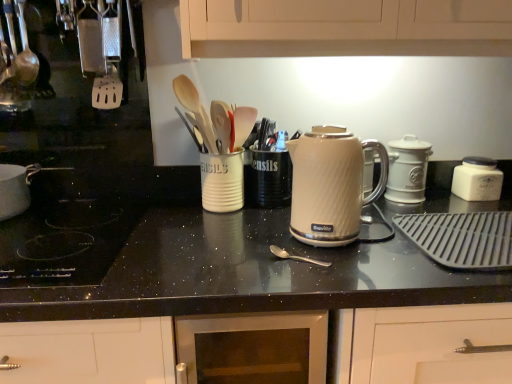
This screenshot has width=512, height=384. Identify the location of free space that is to the left of cream matte electric kettle at center, which is counted as the first kitchen appliance, starting from the left. (267, 243).